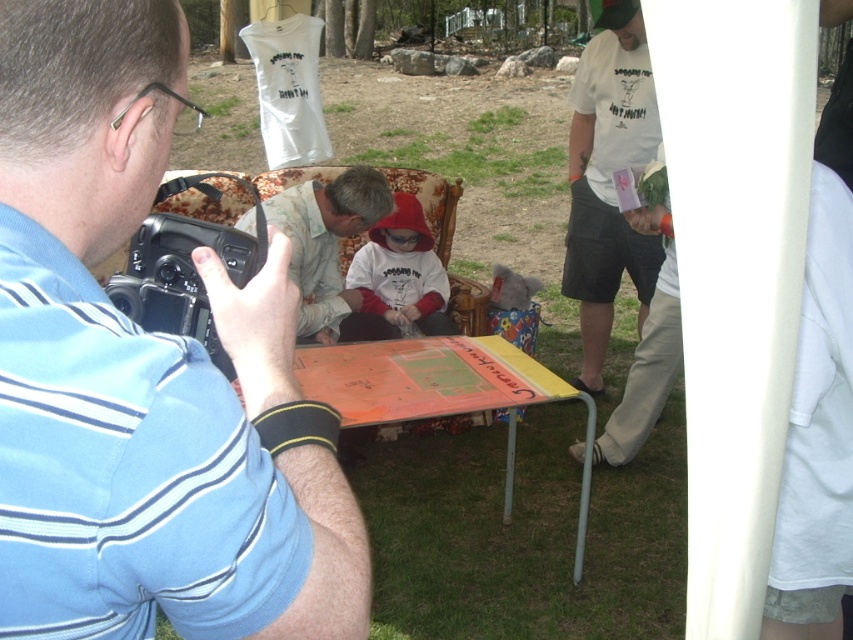
Question: Does blue striped shirt at upper left have a lesser width compared to white cotton t-shirt at upper right?

Choices:
 (A) yes
 (B) no

Answer: (A)

Question: Among these points, which one is farthest from the camera?

Choices:
 (A) (433, 365)
 (B) (610, 196)
 (C) (352, 179)

Answer: (B)

Question: Which of the following is the farthest from the observer?

Choices:
 (A) (480, 396)
 (B) (363, 278)
 (C) (589, 131)

Answer: (C)

Question: Which point is closer to the camera taking this photo?

Choices:
 (A) (593, 58)
 (B) (83, 90)
 (C) (376, 180)

Answer: (B)

Question: Can you confirm if orange painted wood picnic table at center is positioned to the right of matte white hoodie at center?

Choices:
 (A) yes
 (B) no

Answer: (A)

Question: Is the position of orange painted wood picnic table at center less distant than that of matte white hoodie at center?

Choices:
 (A) yes
 (B) no

Answer: (A)